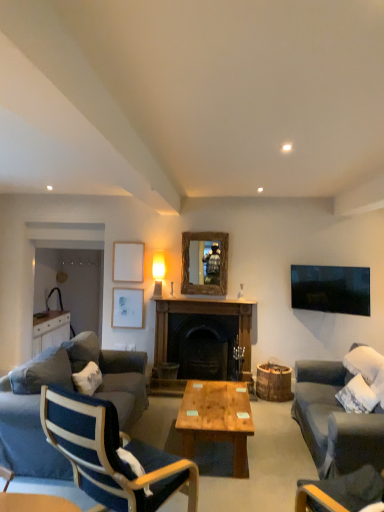
Question: Is blue fabric couch at lower left, positioned as the first studio couch in back-to-front order, aimed at blue fabric chair at left, which is the second chair in right-to-left order?

Choices:
 (A) yes
 (B) no

Answer: (B)

Question: From a real-world perspective, is blue fabric couch at lower left, which is counted as the first studio couch, starting from the left, positioned over blue fabric chair at left, which ranks as the first chair in left-to-right order, based on gravity?

Choices:
 (A) no
 (B) yes

Answer: (A)

Question: Considering the relative sizes of blue fabric couch at lower left, positioned as the second studio couch in front-to-back order, and blue fabric chair at left, which ranks as the first chair in left-to-right order, in the image provided, is blue fabric couch at lower left, positioned as the second studio couch in front-to-back order, thinner than blue fabric chair at left, which ranks as the first chair in left-to-right order,?

Choices:
 (A) no
 (B) yes

Answer: (A)

Question: From the image's perspective, does blue fabric couch at lower left, which is counted as the first studio couch, starting from the left, appear lower than blue fabric chair at left, which ranks as the first chair in left-to-right order?

Choices:
 (A) no
 (B) yes

Answer: (B)

Question: Is blue fabric couch at lower left, arranged as the 2th studio couch when viewed from the right, smaller than blue fabric chair at left, which ranks as the first chair in left-to-right order?

Choices:
 (A) yes
 (B) no

Answer: (B)

Question: From a real-world perspective, is blue fabric chair at left, which ranks as the first chair in left-to-right order, physically located above or below wooden mirror at center?

Choices:
 (A) above
 (B) below

Answer: (B)

Question: Would you say blue fabric chair at left, which is the second chair in right-to-left order, is to the left or to the right of wooden mirror at center in the picture?

Choices:
 (A) right
 (B) left

Answer: (B)

Question: Looking at the image, does blue fabric chair at left, which ranks as the first chair in left-to-right order, seem bigger or smaller compared to wooden mirror at center?

Choices:
 (A) small
 (B) big

Answer: (B)

Question: Considering their positions, is blue fabric chair at left, which ranks as the first chair in left-to-right order, located in front of or behind wooden mirror at center?

Choices:
 (A) behind
 (B) front

Answer: (B)

Question: In terms of size, does wooden/matte coffee table at center appear bigger or smaller than white matte picture frame at upper center, marked as the 2th picture frame in a top-to-bottom arrangement?

Choices:
 (A) small
 (B) big

Answer: (B)

Question: In terms of height, does wooden/matte coffee table at center look taller or shorter compared to white matte picture frame at upper center, acting as the first picture frame starting from the bottom?

Choices:
 (A) short
 (B) tall

Answer: (A)

Question: From a real-world perspective, relative to white matte picture frame at upper center, marked as the 2th picture frame in a top-to-bottom arrangement, is wooden/matte coffee table at center vertically above or below?

Choices:
 (A) above
 (B) below

Answer: (B)

Question: Considering the positions of point (210, 397) and point (117, 295), is point (210, 397) closer or farther from the camera than point (117, 295)?

Choices:
 (A) closer
 (B) farther

Answer: (A)

Question: In the image, is white matte picture frame at upper center, marked as the 2th picture frame in a top-to-bottom arrangement, positioned in front of or behind dark gray fabric couch at right, which is counted as the first studio couch, starting from the front?

Choices:
 (A) front
 (B) behind

Answer: (B)

Question: From the image's perspective, is white matte picture frame at upper center, acting as the first picture frame starting from the bottom, located above or below dark gray fabric couch at right, which is counted as the first studio couch, starting from the front?

Choices:
 (A) below
 (B) above

Answer: (B)